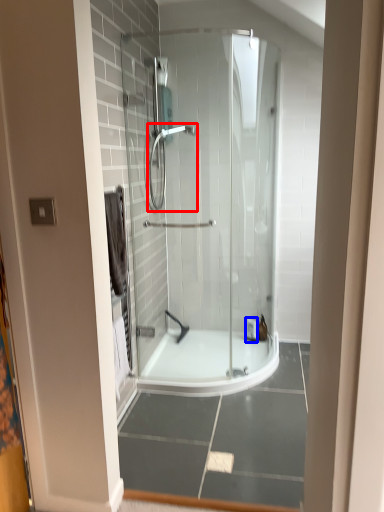
Question: Which point is closer to the camera, shower (highlighted by a red box) or toiletry (highlighted by a blue box)?

Choices:
 (A) shower
 (B) toiletry

Answer: (A)